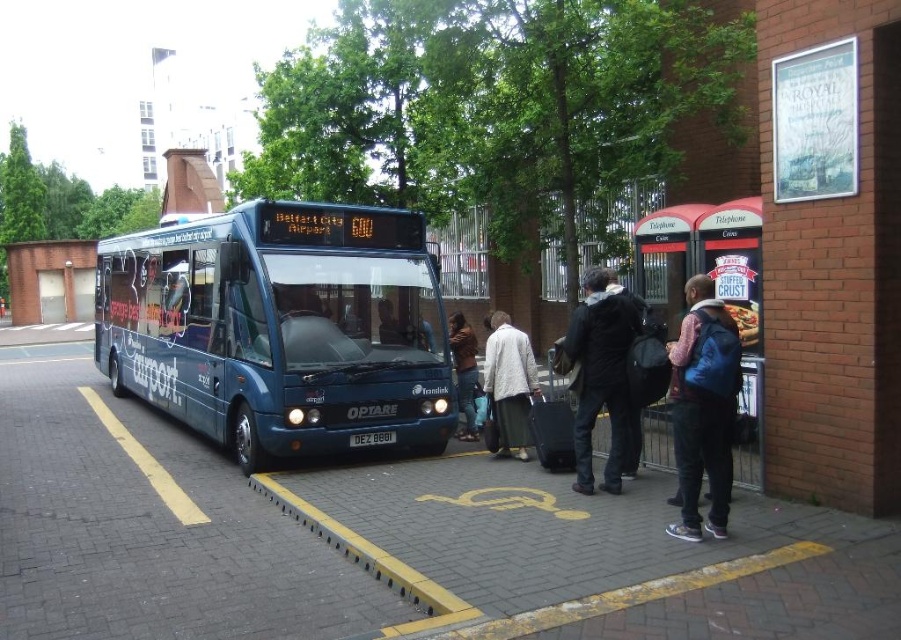
Which is in front, point (410, 237) or point (611, 397)?

Point (611, 397) is more forward.

How much distance is there between blue metallic bus at center and dark blue jacket at center?

The distance of blue metallic bus at center from dark blue jacket at center is 4.58 meters.

At what (x,y) coordinates should I click in order to perform the action: click on blue metallic bus at center. Please return your answer as a coordinate pair (x, y). Image resolution: width=901 pixels, height=640 pixels. Looking at the image, I should click on (280, 328).

Locate an element on the screen. This screenshot has height=640, width=901. blue metallic bus at center is located at coordinates (280, 328).

Is point (623, 413) farther from viewer compared to point (369, 566)?

Yes, point (623, 413) is behind point (369, 566).

Is dark blue jacket at center wider than yellow rubber curb at lower center?

In fact, dark blue jacket at center might be narrower than yellow rubber curb at lower center.

The height and width of the screenshot is (640, 901). What do you see at coordinates (601, 374) in the screenshot?
I see `dark blue jacket at center` at bounding box center [601, 374].

You are a GUI agent. You are given a task and a screenshot of the screen. Output one action in this format:
    pyautogui.click(x=<x>, y=<y>)
    Task: Click on the dark blue jacket at center
    The height and width of the screenshot is (640, 901).
    Given the screenshot: What is the action you would take?
    pyautogui.click(x=601, y=374)

Can you confirm if blue metallic bus at center is taller than blue backpack at center?

Yes, blue metallic bus at center is taller than blue backpack at center.

Can you confirm if blue metallic bus at center is shorter than blue backpack at center?

In fact, blue metallic bus at center may be taller than blue backpack at center.

Is point (363, 390) behind point (690, 397)?

Yes, point (363, 390) is farther from viewer.

The width and height of the screenshot is (901, 640). What are the coordinates of `blue metallic bus at center` in the screenshot? It's located at pos(280,328).